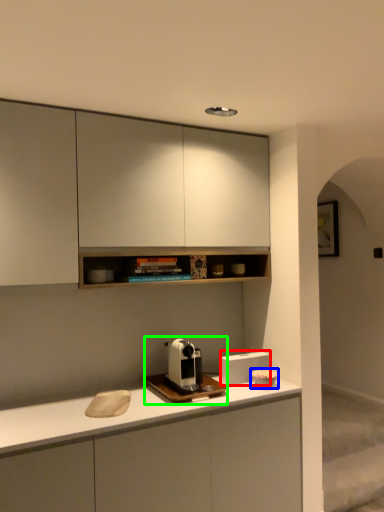
Question: Based on their relative distances, which object is farther from appliance (highlighted by a red box)? Choose from appliance (highlighted by a blue box) and coffee machine (highlighted by a green box).

Choices:
 (A) appliance
 (B) coffee machine

Answer: (B)